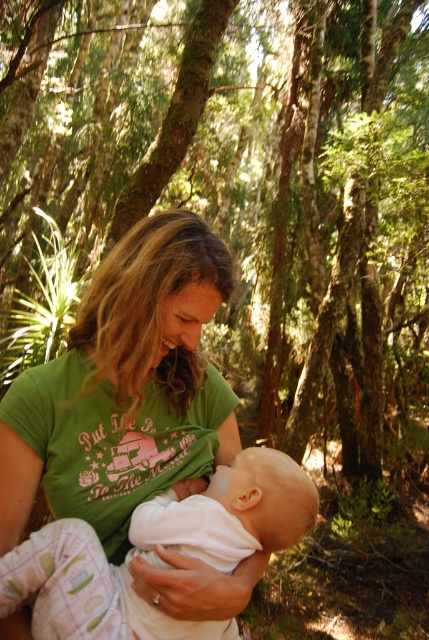
In the scene shown: You are a photographer trying to capture the scene of a mother and baby in a forest. You notice the green cotton shirt at center and the white soft baby at center. Which object is positioned to the left of the other?

The green cotton shirt at center is positioned on the left side of white soft baby at center.

You are standing in a forest and want to reach a specific point marked as point (135,484). If your walking speed is 3 feet per second, how many seconds will it take you to reach that point?

The distance between point (135,484) and the viewer is 4.08 feet. At a speed of 3 feet per second, it would take approximately 1.36 seconds to reach the point.

You are a photographer who wants to take a closeup shot of the white soft baby at center without the green cotton shirt at center blocking the view. Is this possible given their positions?

The green cotton shirt at center is further to the viewer than the white soft baby at center, so the shirt would block the baby from view. You cannot take a closeup of the white soft baby at center without the green cotton shirt at center in the way.